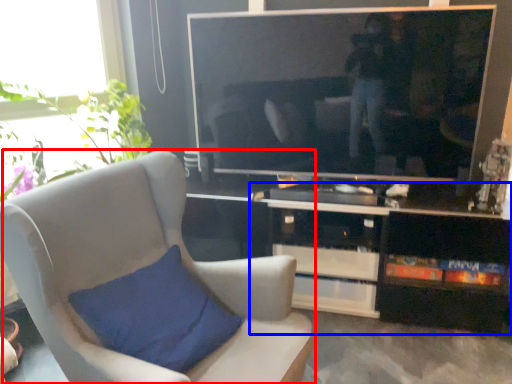
Question: Which object is closer to the camera taking this photo, chair (highlighted by a red box) or cabinetry (highlighted by a blue box)?

Choices:
 (A) chair
 (B) cabinetry

Answer: (A)